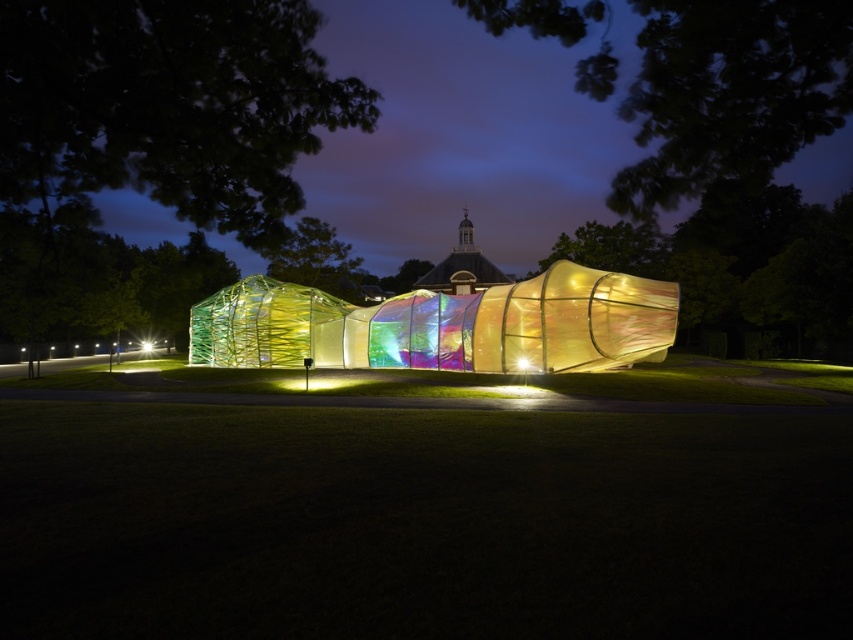
At what (x,y) coordinates should I click in order to perform the action: click on iridescent fabric tent at center. Please return your answer as a coordinate pair (x, y). Image resolution: width=853 pixels, height=640 pixels. Looking at the image, I should click on (442, 324).

How distant is iridescent fabric tent at center from transparent fabric at center?

iridescent fabric tent at center and transparent fabric at center are 16.99 feet apart.

Does point (250, 307) come behind point (525, 364)?

Yes, point (250, 307) is behind point (525, 364).

This screenshot has width=853, height=640. In order to click on iridescent fabric tent at center in this screenshot , I will do (442, 324).